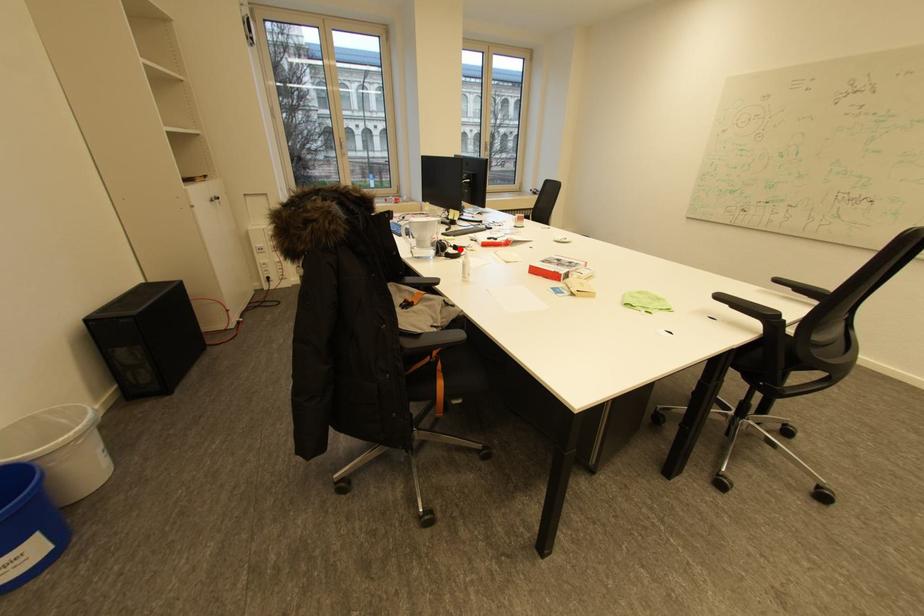
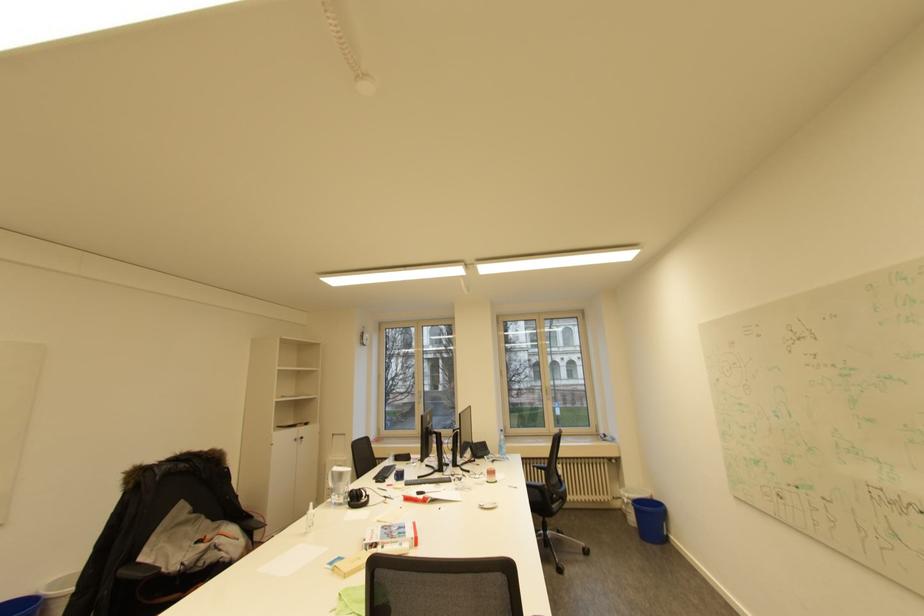
Question: I am providing you with two images of the same scene from different viewpoints. A red point is marked on the first image. At the location where the point appears in image 1, is it still visible in image 2?

Choices:
 (A) Yes
 (B) No

Answer: (B)